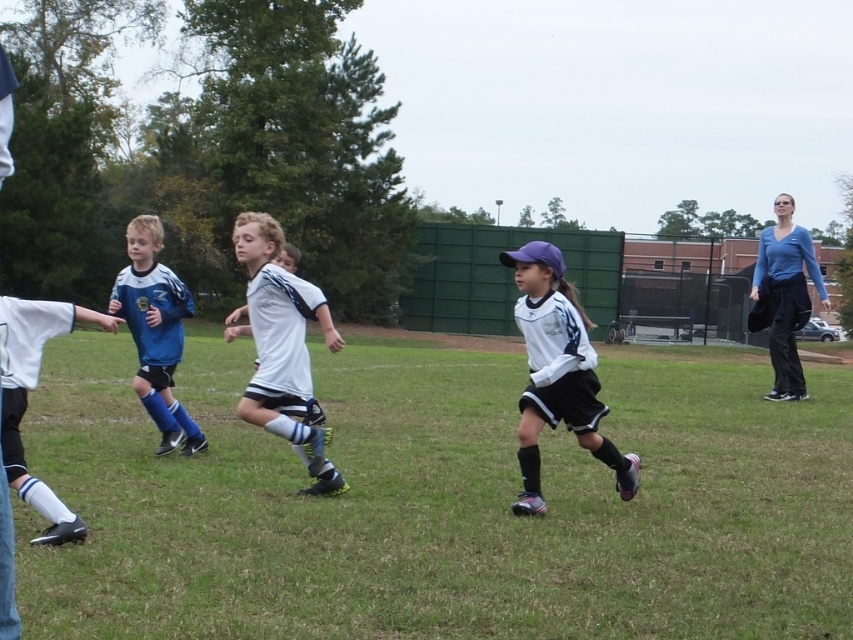
You are a photographer standing at the edge of the soccer field. You want to take a photo that includes both the white matte soccer jersey at center and the blue matte soccer jersey at left. Which jersey should you focus on first to ensure both are in the frame?

You should focus on the white matte soccer jersey at center first because it is closer to the viewer than the blue matte soccer jersey at left, so adjusting the camera to its distance will help capture both in the frame.

You are a photographer standing at the edge of the soccer field. You want to take a photo that includes both the point at coordinate (x=276, y=408) and the point at coordinate (x=169, y=312). Which point should you focus on first to ensure both are in the frame?

You should focus on point (x=276, y=408) first because it is closer to you than point (x=169, y=312), ensuring both points are within the camera frame.